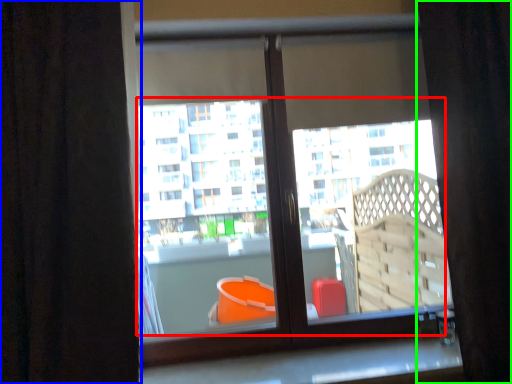
Question: Which object is the closest to the bay window (highlighted by a red box)? Choose among these: curtain (highlighted by a blue box) or curtain (highlighted by a green box).

Choices:
 (A) curtain
 (B) curtain

Answer: (B)